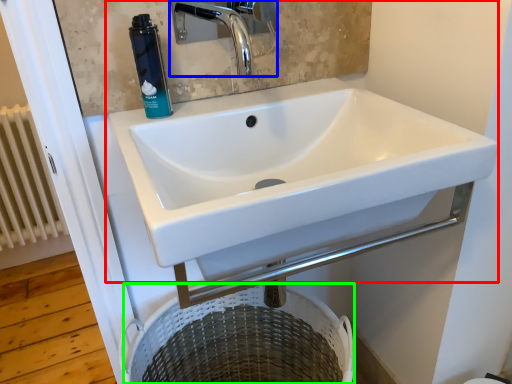
Question: Which object is positioned farthest from sink (highlighted by a red box)? Select from tap (highlighted by a blue box) and laundry basket (highlighted by a green box).

Choices:
 (A) tap
 (B) laundry basket

Answer: (A)